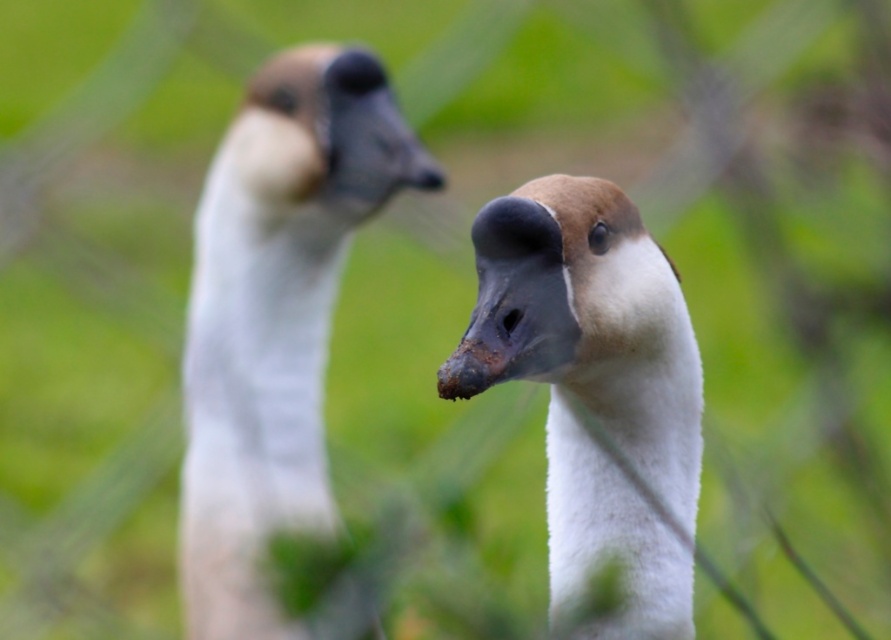
Question: Considering the real-world distances, which object is farthest from the white feathered neck at center?

Choices:
 (A) white matte duck at center
 (B) white fluffy neck at center
 (C) matte white duck at left
 (D) brown matte goose head at center

Answer: (D)

Question: Is white feathered neck at center below brown matte goose head at center?

Choices:
 (A) yes
 (B) no

Answer: (A)

Question: Considering the relative positions of matte white duck at left and brown matte goose head at upper left in the image provided, where is matte white duck at left located with respect to brown matte goose head at upper left?

Choices:
 (A) below
 (B) above

Answer: (A)

Question: Does white feathered neck at center come in front of brown matte beak at center?

Choices:
 (A) yes
 (B) no

Answer: (A)

Question: Considering the real-world distances, which object is farthest from the white fluffy neck at center?

Choices:
 (A) brown matte goose head at upper left
 (B) brown matte goose head at center

Answer: (A)

Question: Which point is closer to the camera?

Choices:
 (A) (593, 474)
 (B) (205, 269)
 (C) (582, 243)
 (D) (427, 184)

Answer: (C)